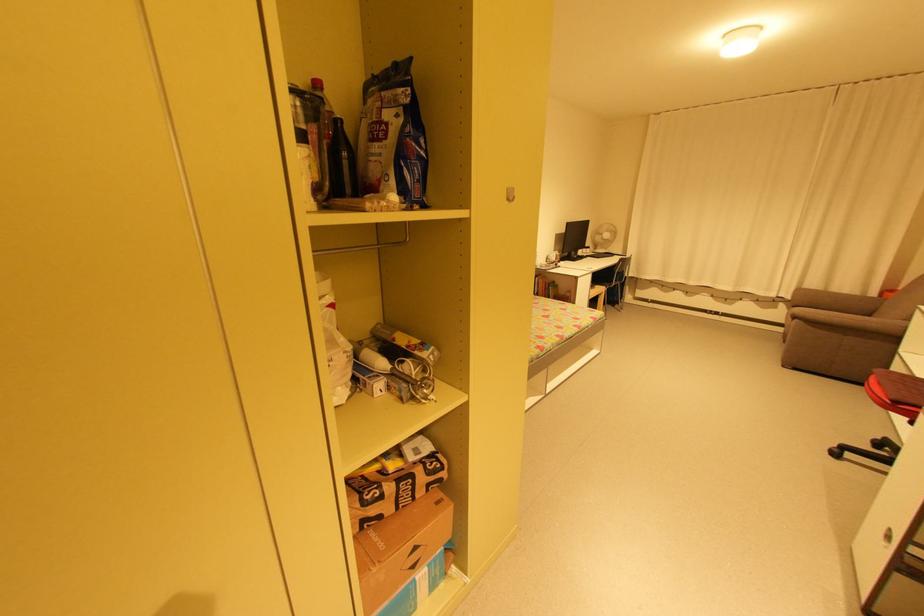
Where would you resting arm on the brown sofa armrest? Please return your answer as a coordinate pair (x, y).

(864, 360)